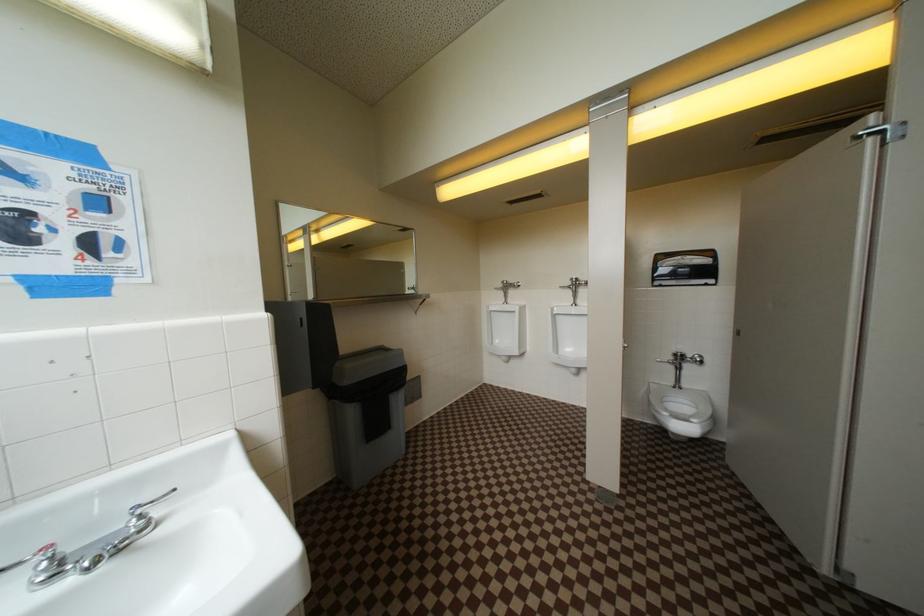
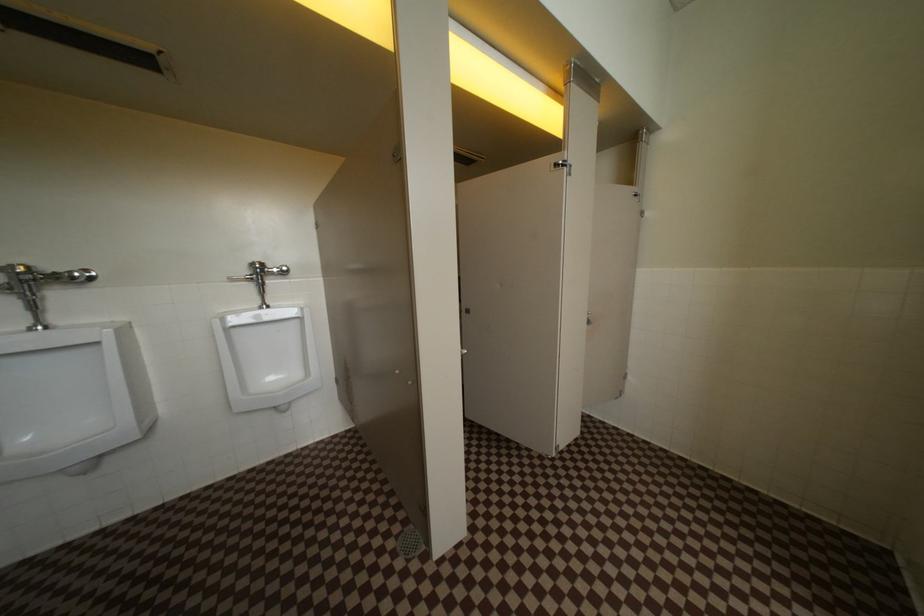
Question: The first image is from the beginning of the video and the second image is from the end. How did the camera likely rotate when shooting the video?

Choices:
 (A) Left
 (B) Right
 (C) Up
 (D) Down

Answer: (B)